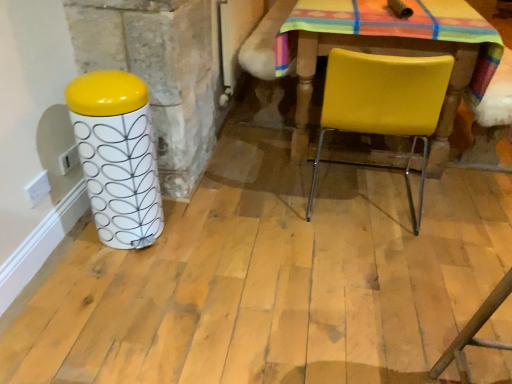
In order to click on vacant area that lies between yellow leather chair at center and white glossy patterned canister at left in this screenshot , I will do `click(245, 214)`.